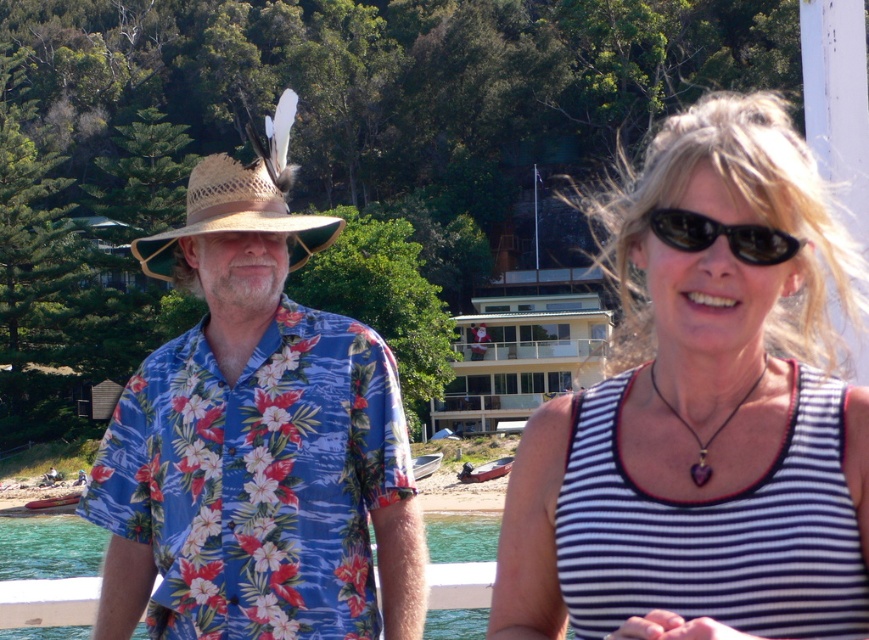
You are a photographer trying to capture a shot of the floral print fabric shirt at left and the clear water at lower left. Based on their positions, which object is closer to the camera?

The floral print fabric shirt at left is located above the clear water at lower left, so it is closer to the camera.

You are a photographer trying to capture the white striped tank top at center. The camera can only focus on objects exactly at point (702, 412). Is the white striped tank top at center at that point?

The white striped tank top at center is located at point (702, 412), so yes, it is exactly at that point and the camera can focus on it.

You are a photographer trying to capture the two people in the scene. The white striped tank top at center and the floral print fabric shirt at left are both in your viewfinder. Which person should you focus on first if you want to ensure both are in focus without adjusting the camera settings?

You should focus on the floral print fabric shirt at left first because it is closer to the camera than the white striped tank top at center, ensuring both will be in focus if you focus on the closer subject.